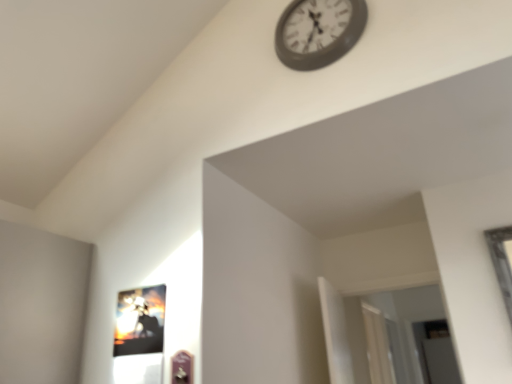
Question: Does metallic glossy picture frame at lower left lie behind metallic gray clock at upper center?

Choices:
 (A) yes
 (B) no

Answer: (B)

Question: Is metallic glossy picture frame at lower left completely or partially outside of metallic gray clock at upper center?

Choices:
 (A) no
 (B) yes

Answer: (B)

Question: Are metallic glossy picture frame at lower left and metallic gray clock at upper center making contact?

Choices:
 (A) no
 (B) yes

Answer: (A)

Question: Is metallic glossy picture frame at lower left wider than metallic gray clock at upper center?

Choices:
 (A) yes
 (B) no

Answer: (B)

Question: Are metallic glossy picture frame at lower left and metallic gray clock at upper center located far from each other?

Choices:
 (A) no
 (B) yes

Answer: (B)

Question: From a real-world perspective, is metallic glossy picture frame at lower left on metallic gray clock at upper center?

Choices:
 (A) yes
 (B) no

Answer: (B)

Question: Is metallic gray clock at upper center further to camera compared to metallic glossy picture frame at lower left?

Choices:
 (A) yes
 (B) no

Answer: (A)

Question: Considering the relative sizes of metallic gray clock at upper center and metallic glossy picture frame at lower left in the image provided, is metallic gray clock at upper center shorter than metallic glossy picture frame at lower left?

Choices:
 (A) no
 (B) yes

Answer: (A)

Question: Is metallic gray clock at upper center not within metallic glossy picture frame at lower left?

Choices:
 (A) yes
 (B) no

Answer: (A)

Question: Is metallic gray clock at upper center positioned before metallic glossy picture frame at lower left?

Choices:
 (A) no
 (B) yes

Answer: (A)

Question: Does metallic gray clock at upper center have a greater width compared to metallic glossy picture frame at lower left?

Choices:
 (A) no
 (B) yes

Answer: (B)

Question: Is metallic gray clock at upper center smaller than metallic glossy picture frame at lower left?

Choices:
 (A) yes
 (B) no

Answer: (B)

Question: Does point (359, 33) appear closer or farther from the camera than point (129, 339)?

Choices:
 (A) farther
 (B) closer

Answer: (B)